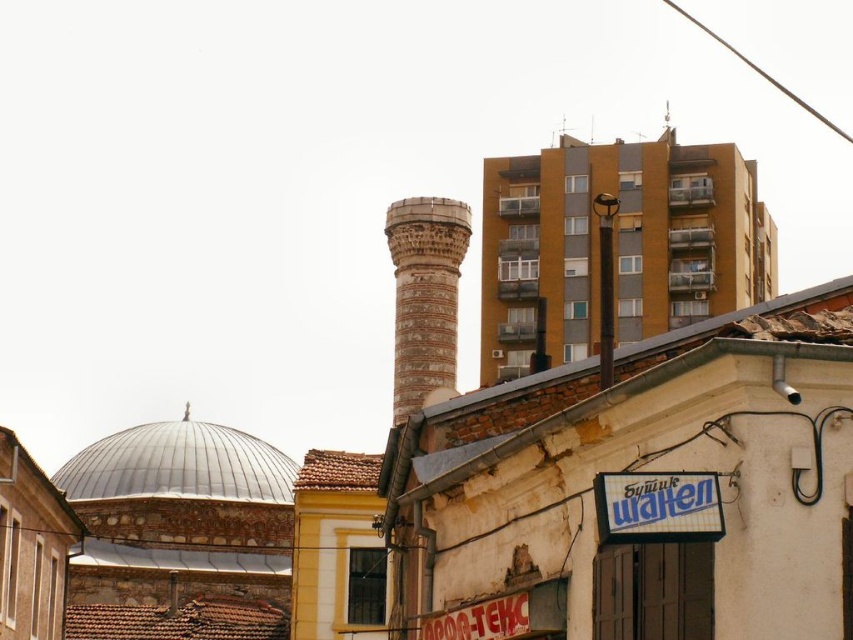
You are a tourist standing in front of the weathered building with the faded signboard. You want to take a photo that includes both the brown stone tower at center and the white plastic sign at lower right. Which object should you position closer to the camera to ensure both are in the frame?

To include both the brown stone tower at center and the white plastic sign at lower right in the photo, position the white plastic sign at lower right closer to the camera since it is shorter than the tower. This way, both objects will be visible within the frame.

You are standing at the point marked as point (425, 296) in the image. What architectural structure are you facing?

The point (425, 296) corresponds to the brown stone tower at center, so you are facing the brown stone tower at center.